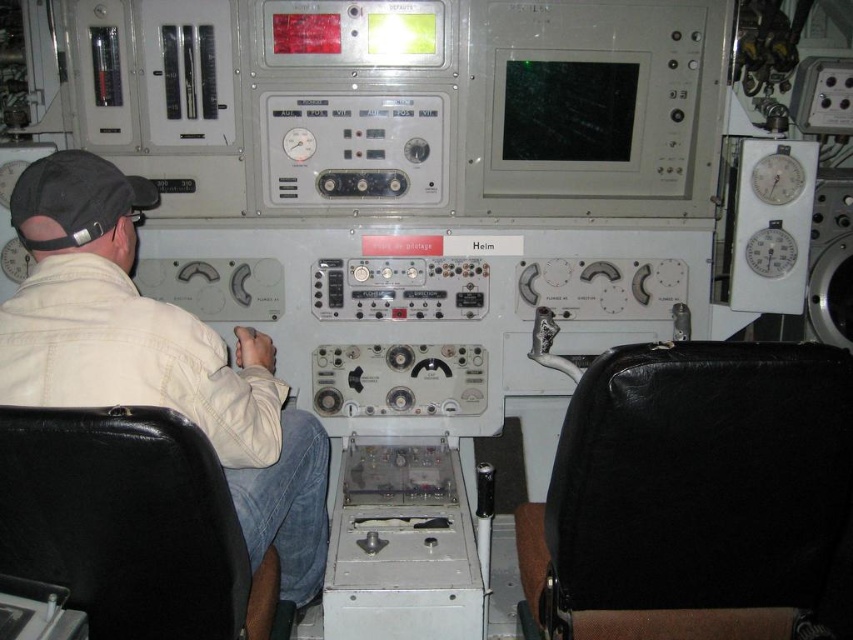
You are standing in the control room and need to sit down to operate the equipment. Where is the black leather chair at right located?

The black leather chair at right is located at point [699,497].

You are a visitor in the control room and want to sit down. There is a black leather chair at right and a white leather jacket at left. Which object is closer to the door if the door is on the left side of the room?

The white leather jacket at left is closer to the door because it is positioned to the left side of the room, and the door is also on the left side. The black leather chair at right is further to the right, making it farther from the door.

You are a maintenance technician needing to reach the black fabric baseball cap at left from the black leather chair at right. Can you comfortably stretch your arms to grab it without moving your chair?

The black leather chair at right is 1.00 meters away from the black fabric baseball cap at left. The average human arm span is about 1.5 meters, so you can comfortably reach it without moving the chair.